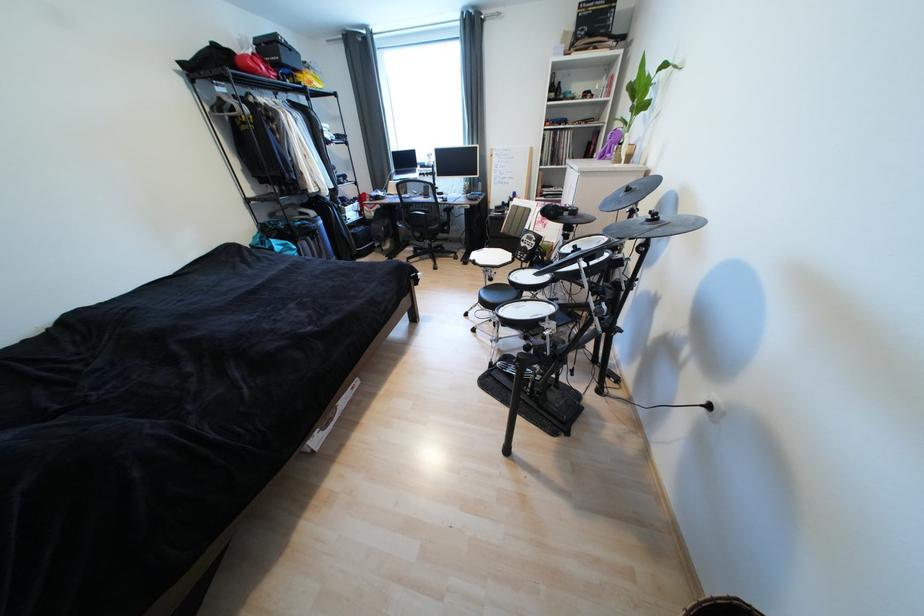
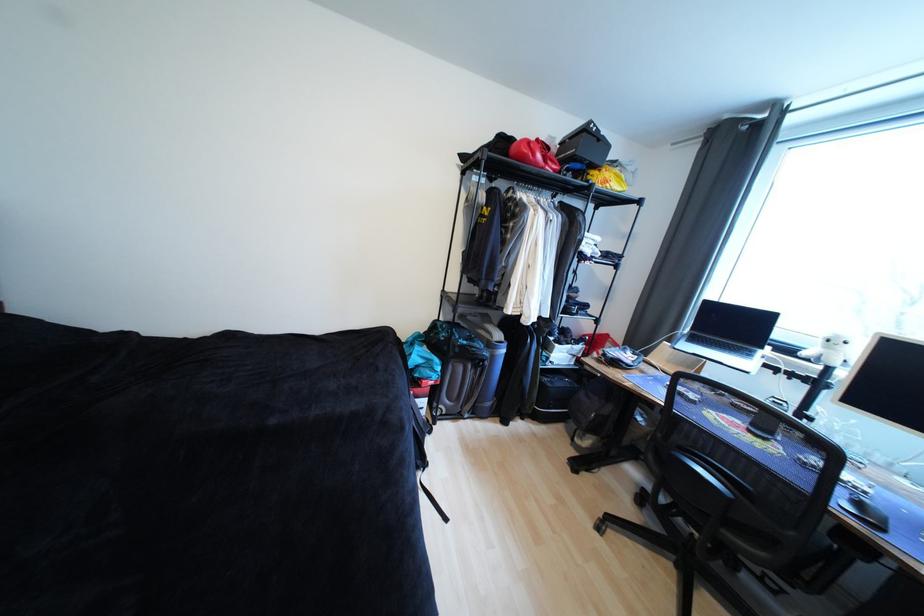
Where in the second image is the point corresponding to (x=435, y=168) from the first image?

(812, 361)